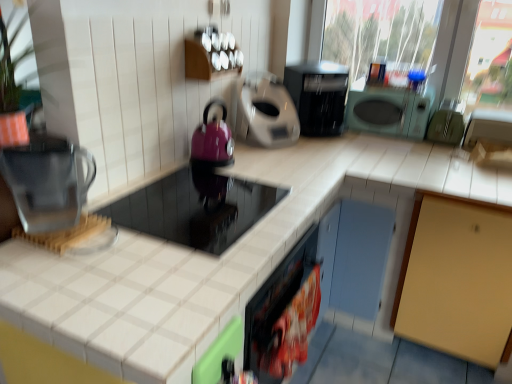
Question: Which direction should I rotate to face plastic bag of chips at lower center, marked as the 4th appliance in a left-to-right arrangement, — up or down?

Choices:
 (A) up
 (B) down

Answer: (B)

Question: Is green rubber gloves at right, marked as the first appliance in a right-to-left arrangement, outside of plastic bag of chips at lower center, marked as the 4th appliance in a left-to-right arrangement?

Choices:
 (A) no
 (B) yes

Answer: (B)

Question: Does green rubber gloves at right, marked as the first appliance in a right-to-left arrangement, have a smaller size compared to plastic bag of chips at lower center, which is counted as the 3th appliance, starting from the right?

Choices:
 (A) no
 (B) yes

Answer: (A)

Question: From a real-world perspective, is green rubber gloves at right, marked as the first appliance in a right-to-left arrangement, beneath plastic bag of chips at lower center, marked as the 4th appliance in a left-to-right arrangement?

Choices:
 (A) yes
 (B) no

Answer: (B)

Question: Is green rubber gloves at right, acting as the sixth appliance starting from the left, closer to the viewer compared to plastic bag of chips at lower center, marked as the 4th appliance in a left-to-right arrangement?

Choices:
 (A) yes
 (B) no

Answer: (B)

Question: Is green rubber gloves at right, acting as the sixth appliance starting from the left, far from plastic bag of chips at lower center, which is counted as the 3th appliance, starting from the right?

Choices:
 (A) no
 (B) yes

Answer: (B)

Question: Does green rubber gloves at right, acting as the sixth appliance starting from the left, come behind plastic bag of chips at lower center, which is counted as the 3th appliance, starting from the right?

Choices:
 (A) no
 (B) yes

Answer: (B)

Question: Can you confirm if white tile countertop at center is taller than matte gray coffee maker at center, acting as the 3th appliance starting from the left?

Choices:
 (A) yes
 (B) no

Answer: (A)

Question: From a real-world perspective, is white tile countertop at center under matte gray coffee maker at center, the 4th appliance in the right-to-left sequence?

Choices:
 (A) yes
 (B) no

Answer: (A)

Question: Considering the relative sizes of white tile countertop at center and matte gray coffee maker at center, the 4th appliance in the right-to-left sequence, in the image provided, is white tile countertop at center wider than matte gray coffee maker at center, the 4th appliance in the right-to-left sequence,?

Choices:
 (A) yes
 (B) no

Answer: (A)

Question: Is white tile countertop at center to the left of matte gray coffee maker at center, the 4th appliance in the right-to-left sequence, from the viewer's perspective?

Choices:
 (A) yes
 (B) no

Answer: (A)

Question: From the image's perspective, is white tile countertop at center beneath matte gray coffee maker at center, acting as the 3th appliance starting from the left?

Choices:
 (A) yes
 (B) no

Answer: (A)

Question: Is white tile countertop at center thinner than matte gray coffee maker at center, the 4th appliance in the right-to-left sequence?

Choices:
 (A) yes
 (B) no

Answer: (B)

Question: Is matte purple kettle at center-left, the 5th appliance from the right, facing towards shiny black cooktop at center, the first appliance from the left?

Choices:
 (A) yes
 (B) no

Answer: (B)